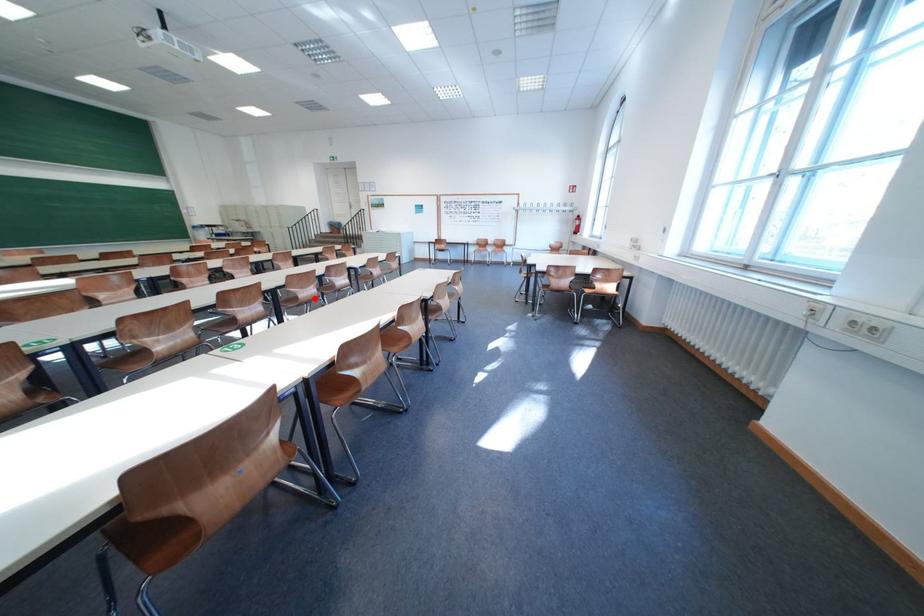
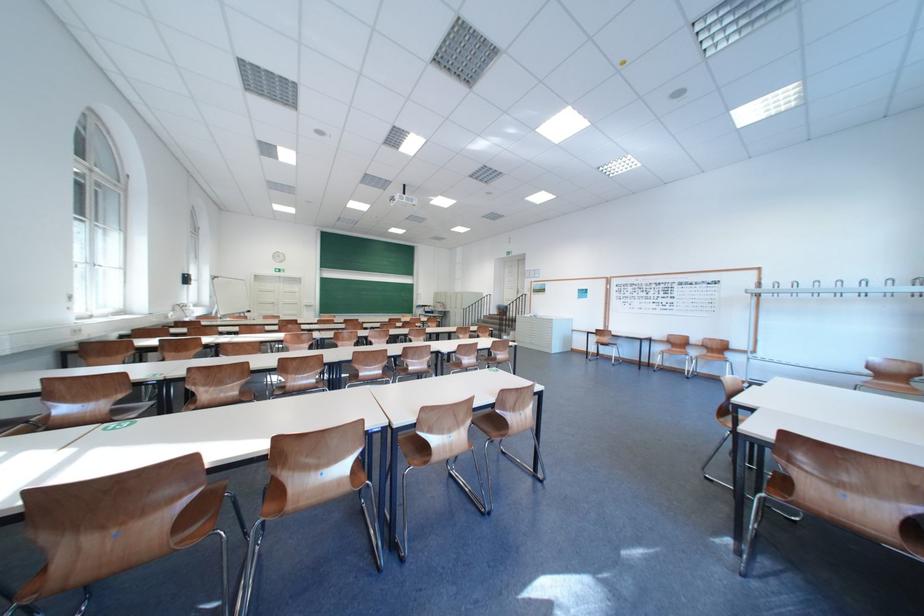
Where in the second image is the point corresponding to the highlighted location from the first image?

(375, 376)